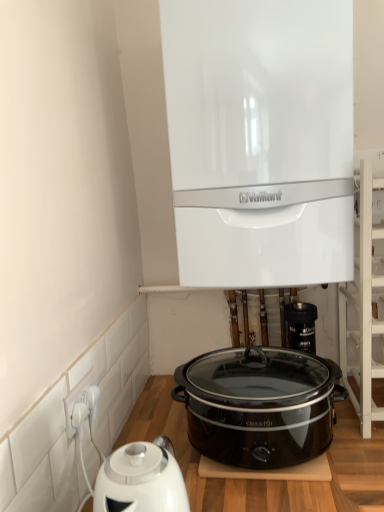
Question: Is black glossy slow cooker at center surrounding white wooden shelf at upper right?

Choices:
 (A) no
 (B) yes

Answer: (A)

Question: From a real-world perspective, is black glossy slow cooker at center on top of white wooden shelf at upper right?

Choices:
 (A) no
 (B) yes

Answer: (A)

Question: Does black glossy slow cooker at center appear on the left side of white wooden shelf at upper right?

Choices:
 (A) yes
 (B) no

Answer: (A)

Question: Considering the relative sizes of black glossy slow cooker at center and white wooden shelf at upper right in the image provided, is black glossy slow cooker at center bigger than white wooden shelf at upper right?

Choices:
 (A) yes
 (B) no

Answer: (B)

Question: Is black glossy slow cooker at center next to white wooden shelf at upper right and touching it?

Choices:
 (A) no
 (B) yes

Answer: (A)

Question: Based on their positions, is white glossy boiler at upper center located to the left or right of black plastic table at lower center?

Choices:
 (A) right
 (B) left

Answer: (B)

Question: Is white glossy boiler at upper center in front of or behind black plastic table at lower center in the image?

Choices:
 (A) behind
 (B) front

Answer: (A)

Question: Is white glossy boiler at upper center taller or shorter than black plastic table at lower center?

Choices:
 (A) tall
 (B) short

Answer: (A)

Question: From a real-world perspective, is white glossy boiler at upper center physically located above or below black plastic table at lower center?

Choices:
 (A) above
 (B) below

Answer: (A)

Question: Is black plastic table at lower center spatially inside black glossy slow cooker at center, or outside of it?

Choices:
 (A) outside
 (B) inside

Answer: (A)

Question: In terms of width, does black plastic table at lower center look wider or thinner when compared to black glossy slow cooker at center?

Choices:
 (A) thin
 (B) wide

Answer: (B)

Question: Is black plastic table at lower center taller or shorter than black glossy slow cooker at center?

Choices:
 (A) short
 (B) tall

Answer: (B)

Question: From the image's perspective, relative to black glossy slow cooker at center, is black plastic table at lower center above or below?

Choices:
 (A) below
 (B) above

Answer: (A)

Question: From a real-world perspective, is white glossy boiler at upper center above or below white plastic socket at lower left?

Choices:
 (A) below
 (B) above

Answer: (B)

Question: Considering the positions of white glossy boiler at upper center and white plastic socket at lower left in the image, is white glossy boiler at upper center wider or thinner than white plastic socket at lower left?

Choices:
 (A) wide
 (B) thin

Answer: (A)